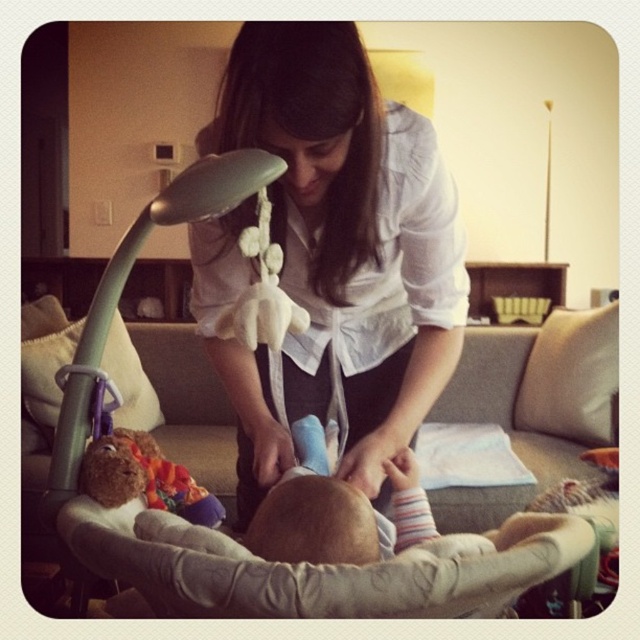
Is gray fabric baby carriage at center positioned before brown plush bear at lower left?

No, it is not.

In the scene shown: Which is more to the left, gray fabric baby carriage at center or brown plush bear at lower left?

brown plush bear at lower left is more to the left.

Locate an element on the screen. Image resolution: width=640 pixels, height=640 pixels. gray fabric baby carriage at center is located at coordinates (300, 563).

Where is `gray fabric baby carriage at center`? gray fabric baby carriage at center is located at coordinates (300, 563).

Between point (314, 161) and point (186, 496), which one is positioned in front?

Point (314, 161)

Is point (385, 438) farther from camera compared to point (115, 493)?

Yes, it is.

This screenshot has height=640, width=640. I want to click on white satin blouse at center, so click(332, 256).

Is white satin blouse at center below gray fabric baby carriage at center?

Actually, white satin blouse at center is above gray fabric baby carriage at center.

Identify the location of white satin blouse at center. The height and width of the screenshot is (640, 640). (332, 256).